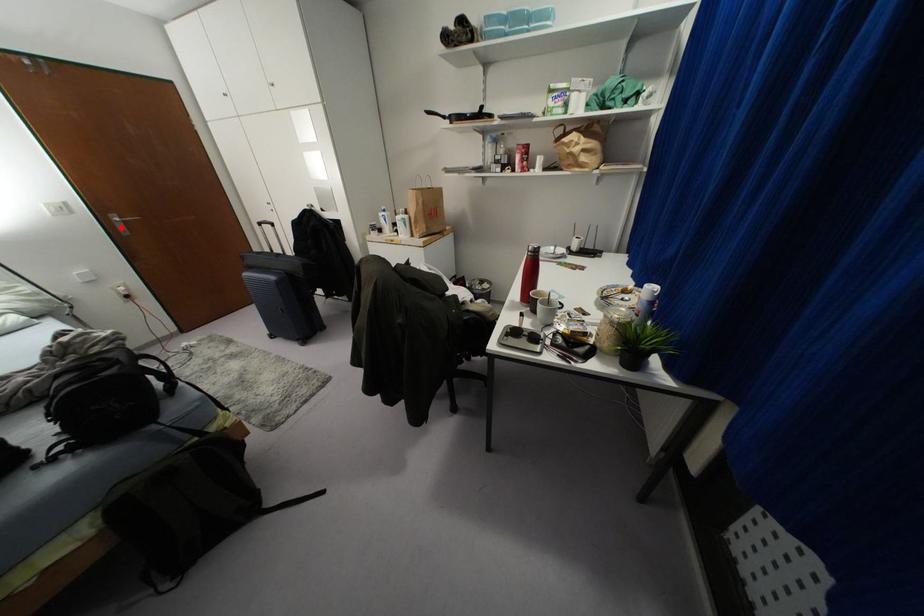
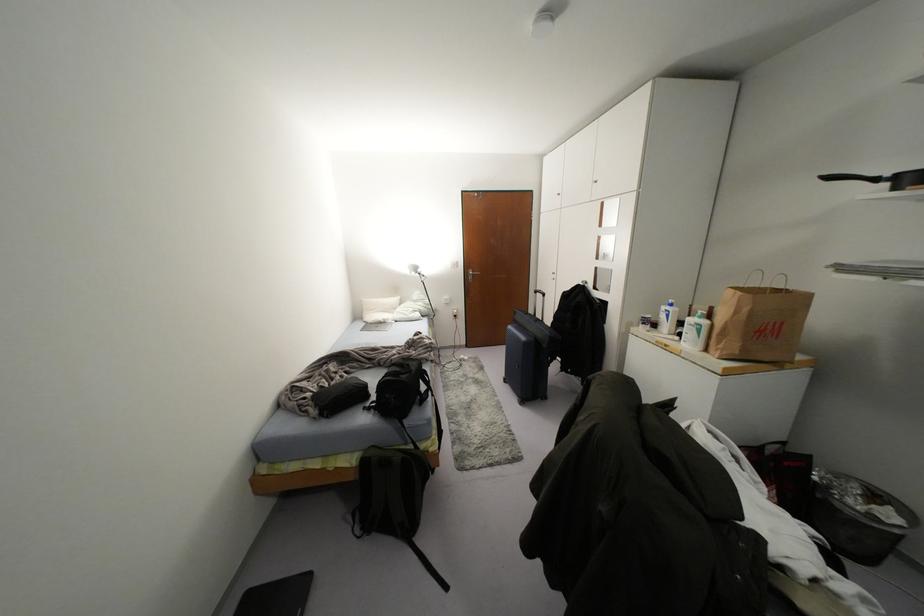
Where in the second image is the point corresponding to the highlighted location from the first image?

(469, 277)